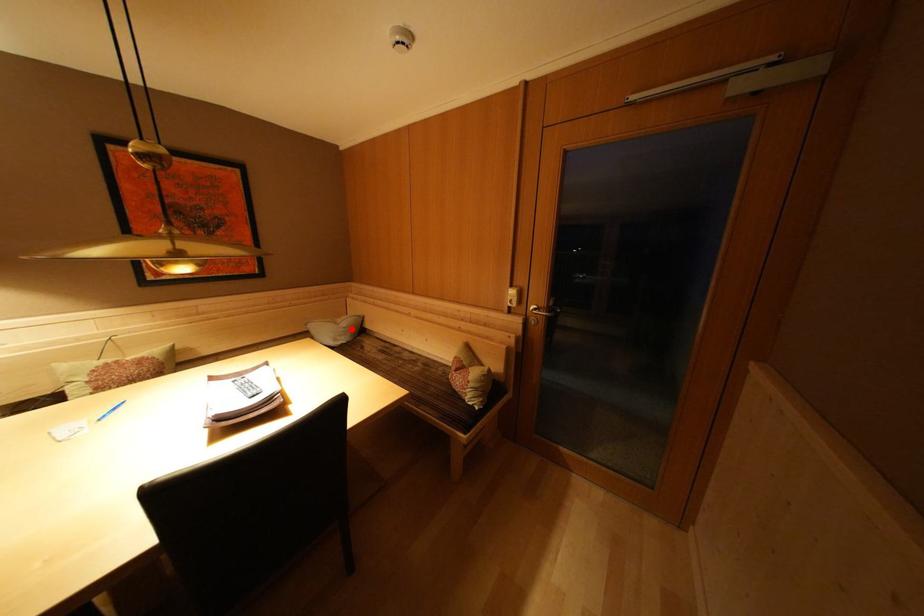
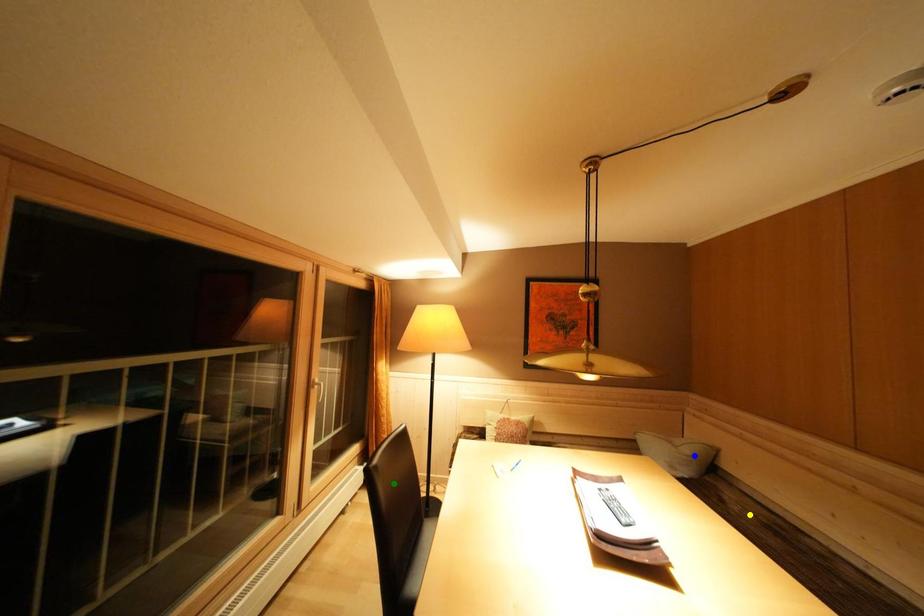
Question: I am providing you with two images of the same scene from different viewpoints. A red point is marked on the first image. You are given multiple points on the second image. Which mark in image 2 goes with the point in image 1?

Choices:
 (A) green point
 (B) yellow point
 (C) blue point

Answer: (C)